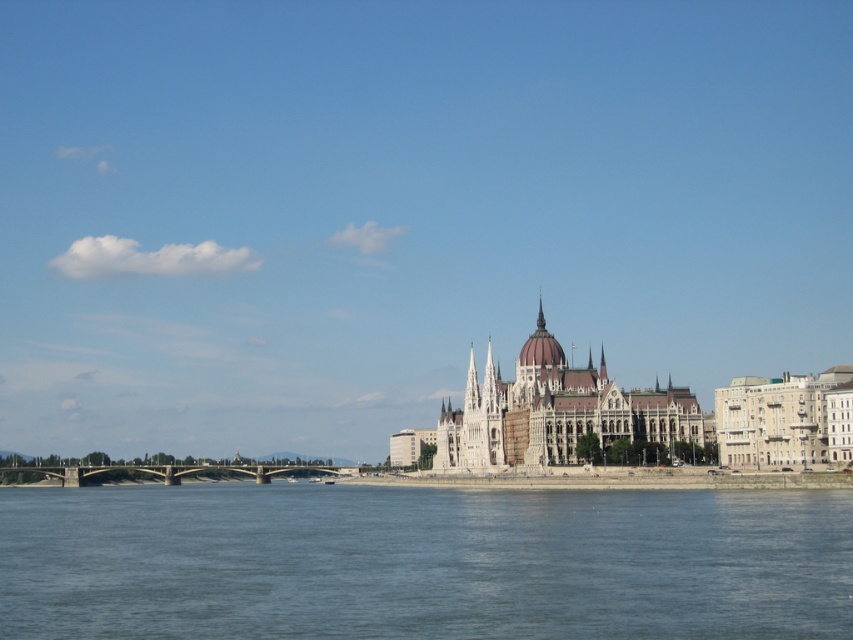
You are standing on the riverbank and want to cross to the other side. You see the blue water at lower center and the concrete bridge at lower left. Which one is closer to you, and would you choose to walk across the bridge or swim through the water?

The blue water at lower center is closer to the viewer than the concrete bridge at lower left. Since the water is closer, you might choose to swim through the blue water at lower center instead of walking across the concrete bridge at lower left, which is farther away.

You are a tourist standing on the concrete bridge at lower left, looking towards the Parliament Building. Which direction should you walk to reach the blue water at lower center?

The blue water at lower center is above the concrete bridge at lower left, so you should walk towards the direction of the Parliament Building to reach the blue water at lower center.

You are a tourist standing on the riverbank near the Parliament Building. You see the blue water at lower center and the concrete bridge at lower left. Which of these two objects occupies a larger area in the image?

The blue water at lower center is bigger than the concrete bridge at lower left, so the blue water at lower center occupies a larger area in the image.